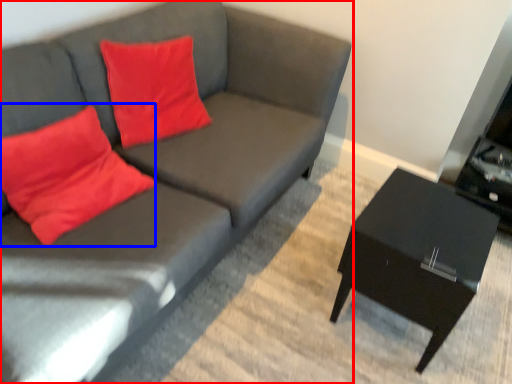
Question: Among these objects, which one is nearest to the camera, studio couch (highlighted by a red box) or throw pillow (highlighted by a blue box)?

Choices:
 (A) studio couch
 (B) throw pillow

Answer: (A)